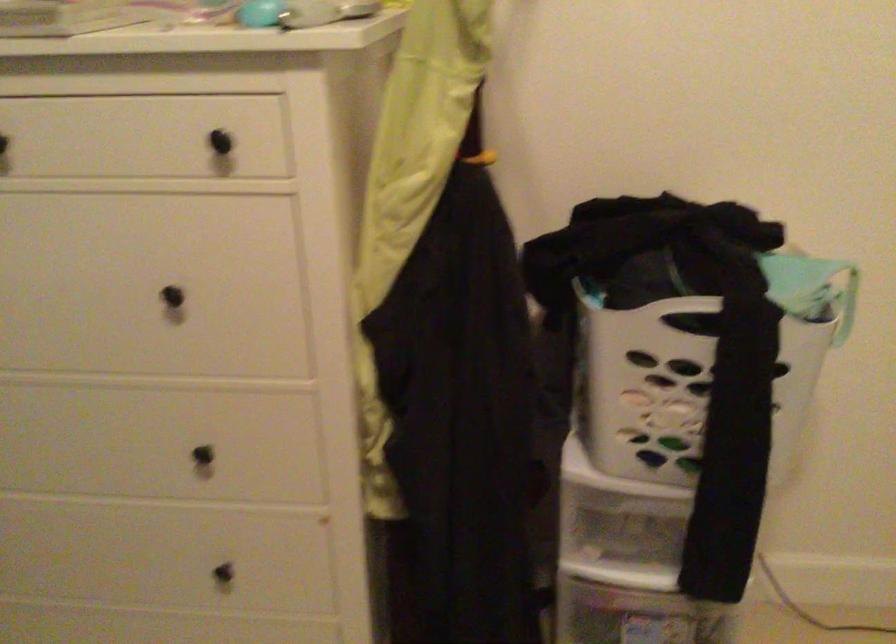
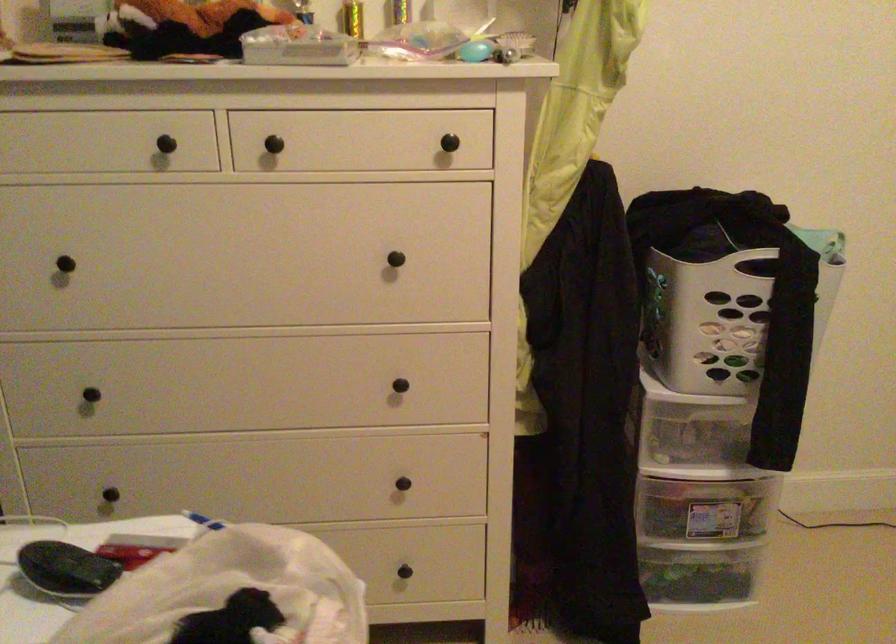
Find the pixel in the second image that matches (x=236, y=127) in the first image.

(453, 128)